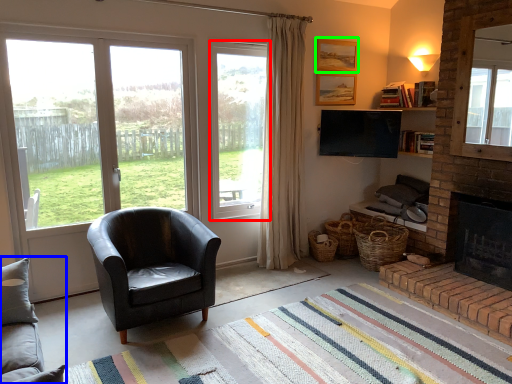
Question: Estimate the real-world distances between objects in this image. Which object is closer to window (highlighted by a red box), studio couch (highlighted by a blue box) or picture frame (highlighted by a green box)?

Choices:
 (A) studio couch
 (B) picture frame

Answer: (B)